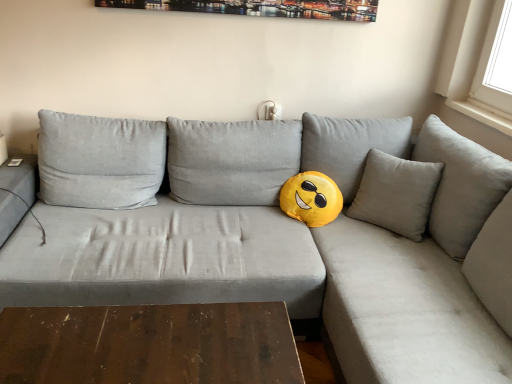
Question: Should I look upward or downward to see light gray fabric couch at center?

Choices:
 (A) up
 (B) down

Answer: (B)